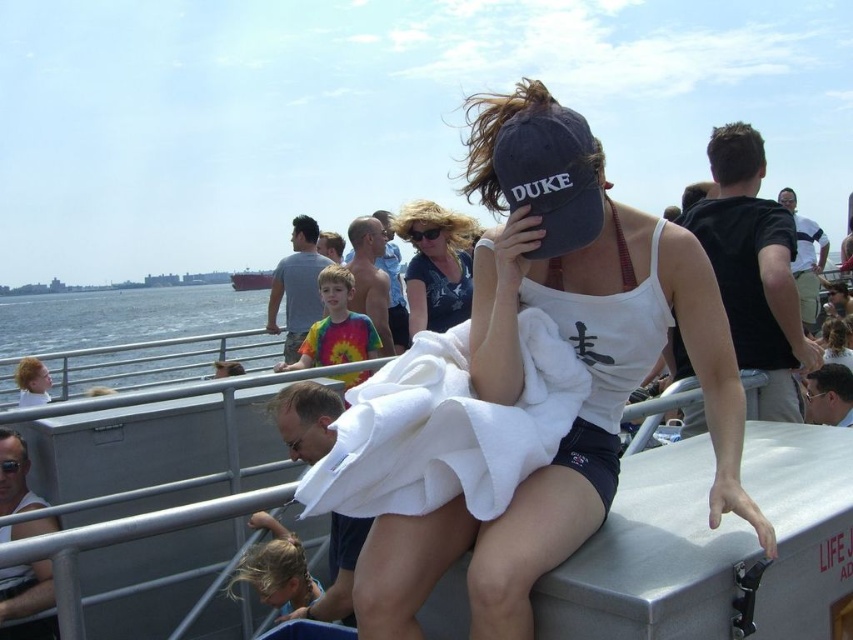
You are standing on the ferry deck and want to move from point A to point B. Point A is at coordinates point (83, 378) and point B is at coordinates point (424, 211). According to the scene, which point is closer to you?

Point (424, 211) is closer to you because it is in front of point (83, 378).